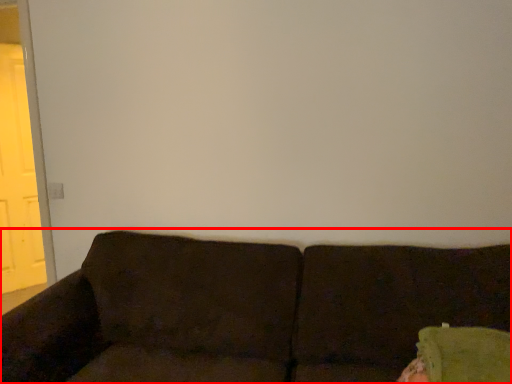
Question: Observing the image, what is the correct spatial positioning of studio couch (annotated by the red box) in reference to screen door?

Choices:
 (A) left
 (B) right

Answer: (B)